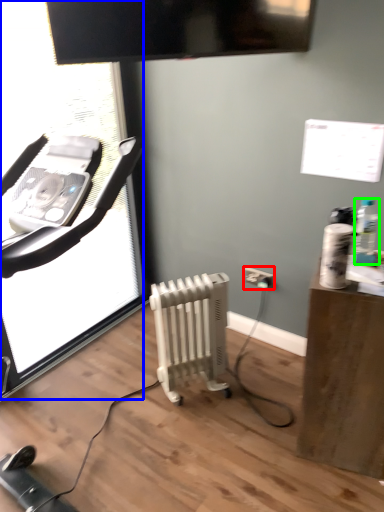
Question: Estimate the real-world distances between objects in this image. Which object is closer to electric outlet (highlighted by a red box), screen door (highlighted by a blue box) or bottle (highlighted by a green box)?

Choices:
 (A) screen door
 (B) bottle

Answer: (B)